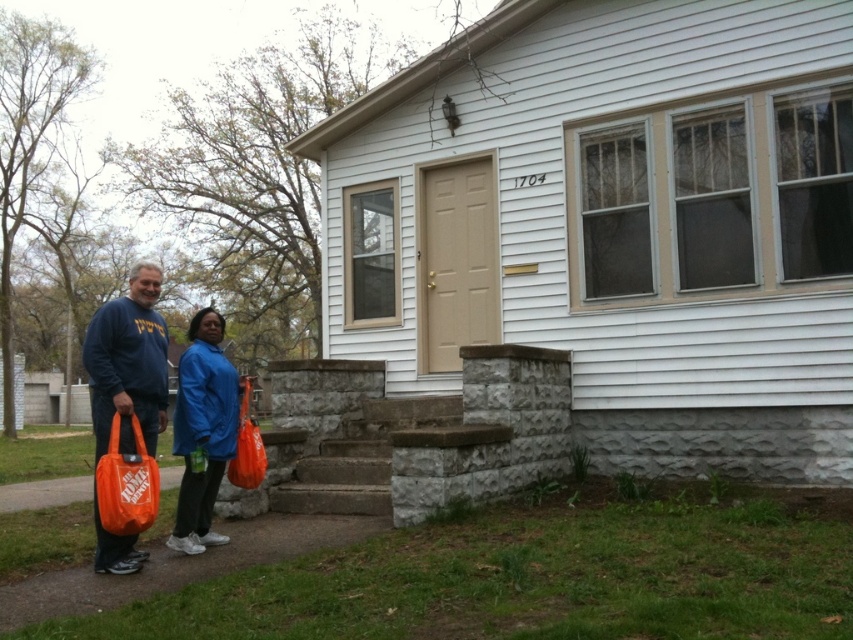
Question: Which point is closer to the camera?

Choices:
 (A) (107, 515)
 (B) (94, 333)

Answer: (A)

Question: Which point is farther from the camera taking this photo?

Choices:
 (A) (120, 525)
 (B) (128, 314)

Answer: (B)

Question: Observing the image, what is the correct spatial positioning of matte blue sweatshirt at left in reference to orange plastic bag at lower left?

Choices:
 (A) right
 (B) left

Answer: (B)

Question: Which point appears farthest from the camera in this image?

Choices:
 (A) (131, 481)
 (B) (99, 458)

Answer: (B)

Question: Is matte blue sweatshirt at left to the right of orange plastic bag at lower left from the viewer's perspective?

Choices:
 (A) yes
 (B) no

Answer: (B)

Question: Is blue fabric jacket at lower left above orange plastic bag at lower left?

Choices:
 (A) no
 (B) yes

Answer: (B)